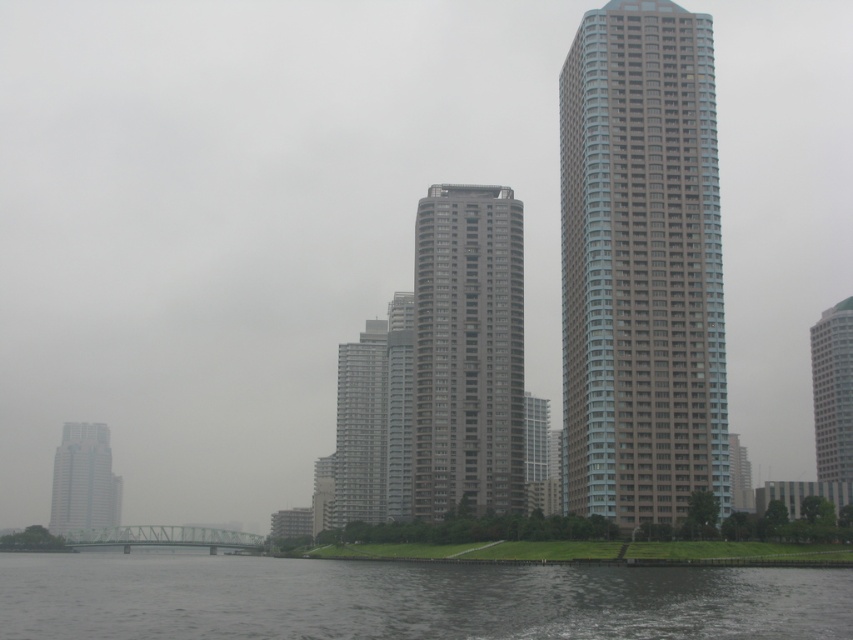
Can you confirm if light gray concrete building at center is wider than dark gray water at lower center?

No, light gray concrete building at center is not wider than dark gray water at lower center.

Can you confirm if light gray concrete building at center is positioned above dark gray water at lower center?

Yes.

What do you see at coordinates (641, 264) in the screenshot? I see `light gray concrete building at center` at bounding box center [641, 264].

Locate an element on the screen. light gray concrete building at center is located at coordinates (641, 264).

Can you confirm if light gray concrete building at center is wider than white glossy building at right?

Incorrect, light gray concrete building at center's width does not surpass white glossy building at right's.

Is point (608, 3) less distant than point (846, 396)?

Yes.

The height and width of the screenshot is (640, 853). Identify the location of light gray concrete building at center. (641, 264).

Is dark gray water at lower center shorter than gray glass building at center?

Correct, dark gray water at lower center is not as tall as gray glass building at center.

Locate an element on the screen. dark gray water at lower center is located at coordinates (408, 600).

What do you see at coordinates (408, 600) in the screenshot?
I see `dark gray water at lower center` at bounding box center [408, 600].

What are the coordinates of `dark gray water at lower center` in the screenshot? It's located at (408, 600).